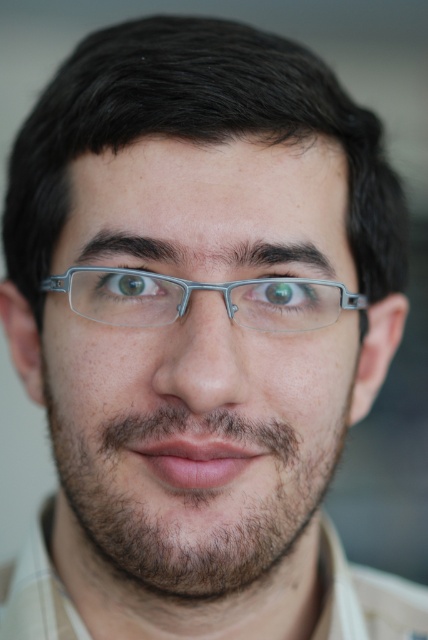
Can you confirm if green matte eye at center is shorter than green matte eye at upper left?

No.

How much distance is there between green matte eye at center and green matte eye at upper left?

The distance of green matte eye at center from green matte eye at upper left is 5.54 centimeters.

Is point (311, 321) farther from viewer compared to point (118, 289)?

Yes, it is behind point (118, 289).

At what (x,y) coordinates should I click in order to perform the action: click on green matte eye at center. Please return your answer as a coordinate pair (x, y). This screenshot has width=428, height=640. Looking at the image, I should click on (284, 298).

Is clear plastic glasses at center below green matte eye at upper left?

Yes.

Who is more forward, (193,509) or (124,289)?

Positioned in front is point (193,509).

This screenshot has width=428, height=640. Identify the location of clear plastic glasses at center. (196, 365).

Is clear plastic glasses at center closer to camera compared to green matte eye at center?

Yes, it is in front of green matte eye at center.

Is point (130, 312) farther from viewer compared to point (284, 321)?

No, (130, 312) is in front of (284, 321).

Find the location of a particular element. clear plastic glasses at center is located at coordinates (196, 365).